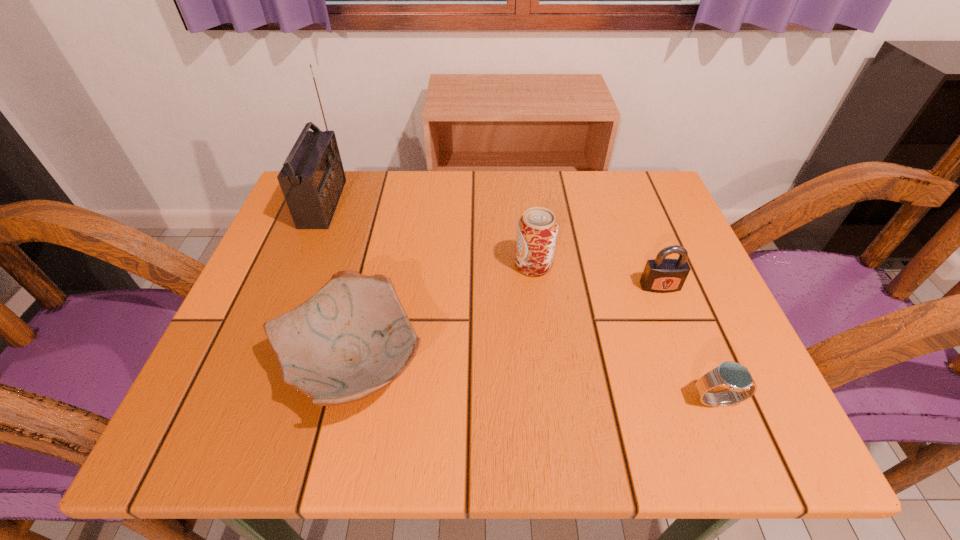
Find the location of a particular element. The height and width of the screenshot is (540, 960). the farthest object is located at coordinates (312, 178).

Locate an element on the screen. This screenshot has height=540, width=960. radio receiver is located at coordinates (312, 178).

The image size is (960, 540). What are the coordinates of `the second tallest object` in the screenshot? It's located at [537, 230].

Locate an element on the screen. The width and height of the screenshot is (960, 540). beer can is located at coordinates (537, 230).

This screenshot has width=960, height=540. Find the location of `padlock`. padlock is located at coordinates (661, 275).

Image resolution: width=960 pixels, height=540 pixels. What are the coordinates of `pottery` in the screenshot? It's located at (352, 338).

Find the location of a particular element. The image size is (960, 540). the shortest object is located at coordinates (737, 378).

Image resolution: width=960 pixels, height=540 pixels. I want to click on vacant space located 0.170m on the front panel of the radio receiver, so click(x=410, y=204).

At what (x,y) coordinates should I click in order to perform the action: click on free space located 0.290m on the back of the third object from right to left. Please return your answer as a coordinate pair (x, y). This screenshot has height=540, width=960. Looking at the image, I should click on (523, 176).

This screenshot has height=540, width=960. Find the location of `free space located 0.120m on the front of the third nearest object near the keyhole`. free space located 0.120m on the front of the third nearest object near the keyhole is located at coordinates (683, 345).